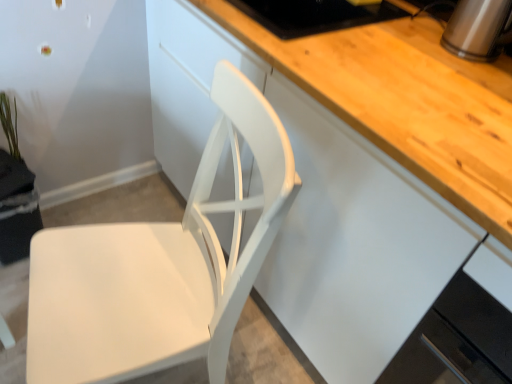
You are a GUI agent. You are given a task and a screenshot of the screen. Output one action in this format:
    pyautogui.click(x=<x>, y=<y>)
    Task: Click on the vacant point to the left of satin silver kettle at upper right
    
    Given the screenshot: What is the action you would take?
    pyautogui.click(x=410, y=45)